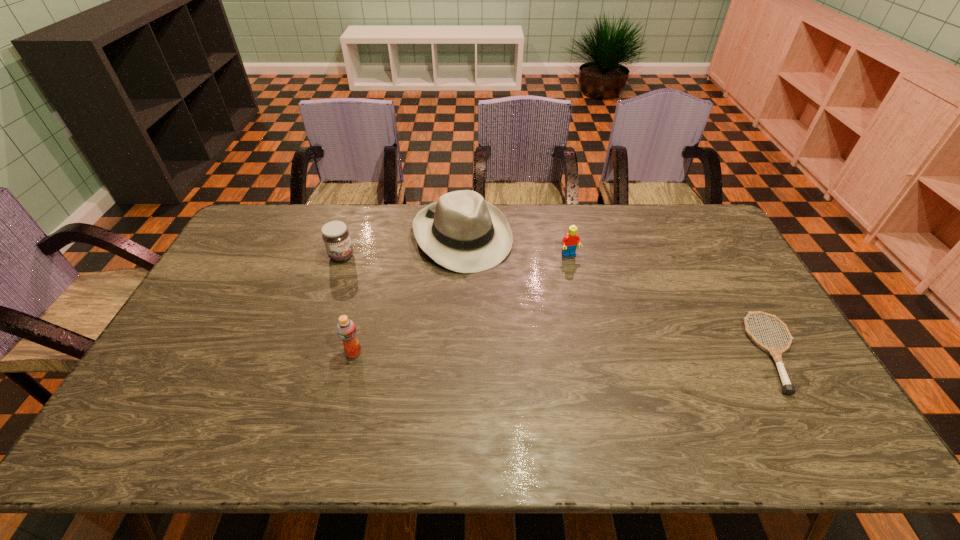
Locate an element on the screen. vacant space located 0.380m on the face of the second object from right to left is located at coordinates coord(623,350).

Where is `vacant space located 0.180m on the front-facing side of the fedora`? The image size is (960, 540). vacant space located 0.180m on the front-facing side of the fedora is located at coordinates (510, 307).

Identify the location of free region located 0.270m on the front-facing side of the fedora. (524, 328).

The image size is (960, 540). Find the location of `vacant space located 0.270m on the front-facing side of the fedora`. vacant space located 0.270m on the front-facing side of the fedora is located at coordinates (524, 328).

Find the location of a particular element. free space located 0.110m on the front label of the leftmost object is located at coordinates (373, 274).

Locate an element on the screen. The width and height of the screenshot is (960, 540). free space located 0.150m on the front label of the leftmost object is located at coordinates (383, 279).

Image resolution: width=960 pixels, height=540 pixels. I want to click on free space located on the front label of the leftmost object, so click(399, 288).

This screenshot has height=540, width=960. I want to click on object positioned at the far edge, so click(462, 232).

You are a GUI agent. You are given a task and a screenshot of the screen. Output one action in this format:
    pyautogui.click(x=<x>, y=<y>)
    Task: Click on the object that is at the near edge
    The width and height of the screenshot is (960, 540).
    Given the screenshot: What is the action you would take?
    pyautogui.click(x=776, y=353)

At what (x,y) coordinates should I click in order to perform the action: click on object that is at the right edge. Please return your answer as a coordinate pair (x, y). The width and height of the screenshot is (960, 540). Looking at the image, I should click on (776, 353).